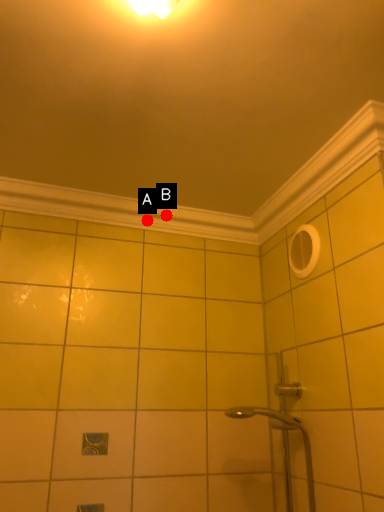
Question: Two points are circled on the image, labeled by A and B beside each circle. Which point appears farthest from the camera in this image?

Choices:
 (A) A is further
 (B) B is further

Answer: (B)